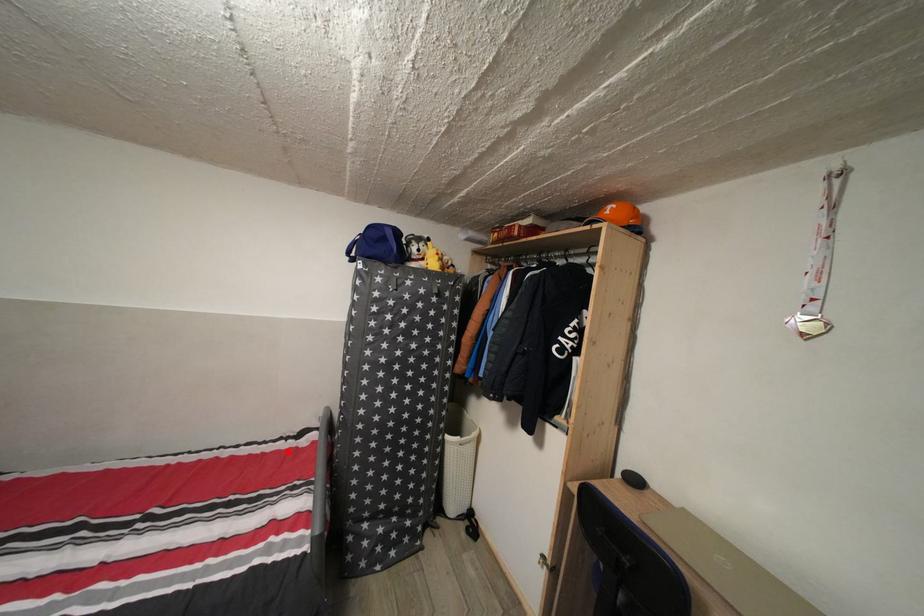
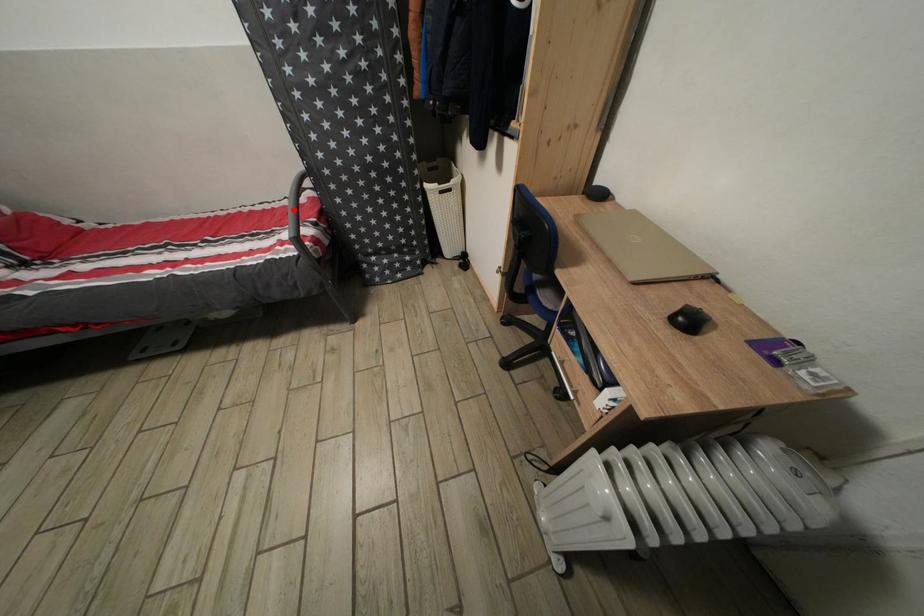
I am providing you with two images of the same scene from different viewpoints. A red point is marked on the first image and another point is marked on the second image. Are the points marked in image1 and image2 representing the same 3D position?

Yes